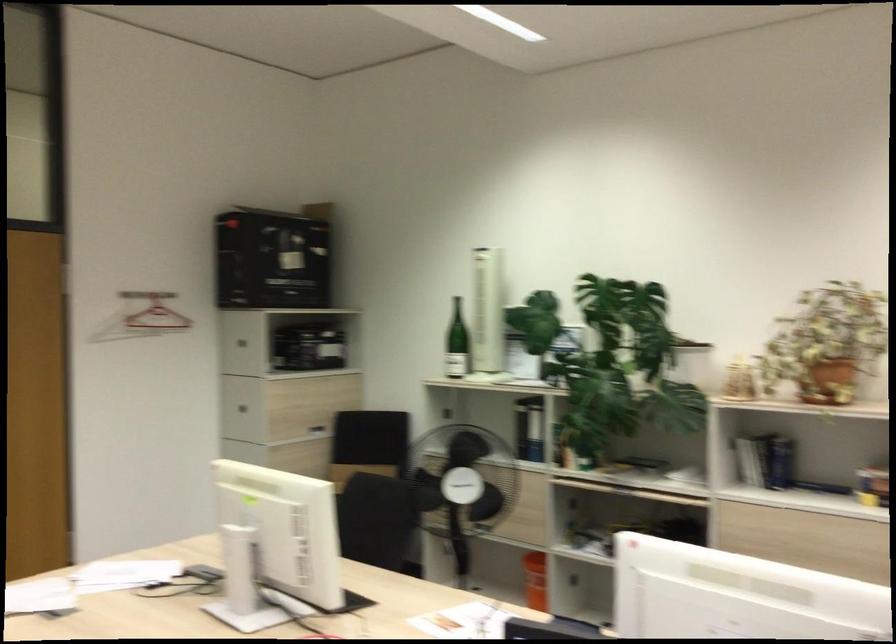
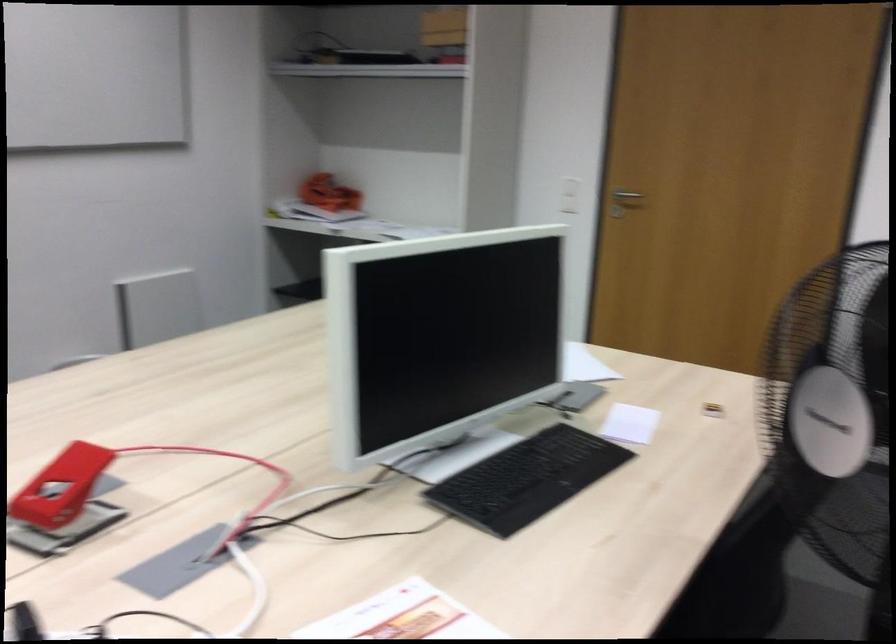
In the second image, find the point that corresponds to [454,478] in the first image.

(831, 408)